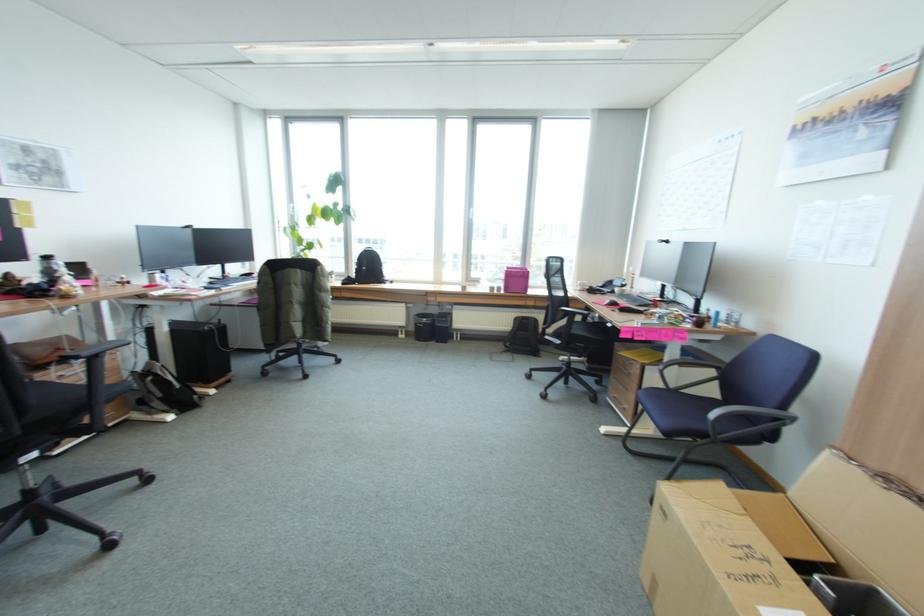
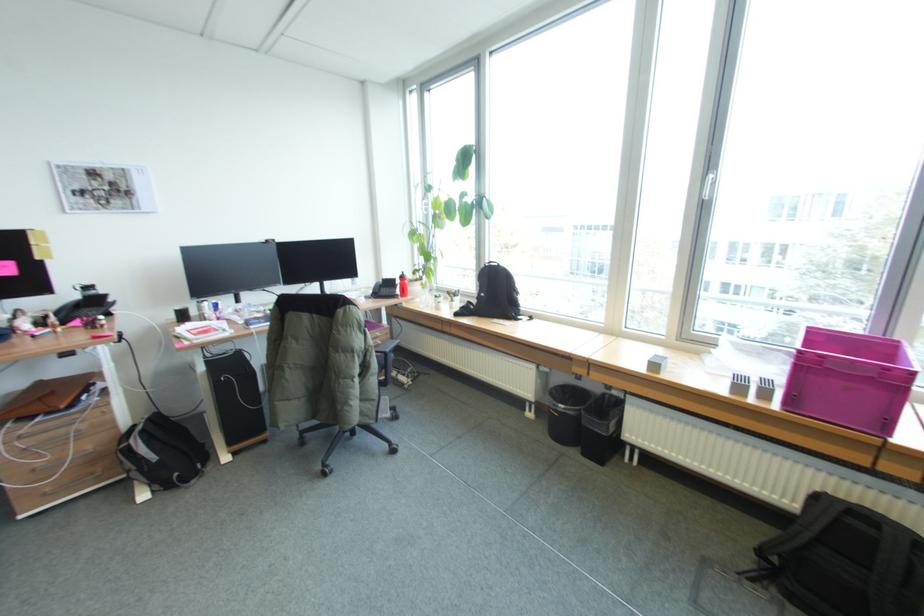
The point at (431, 320) is marked in the first image. Where is the corresponding point in the second image?

(568, 408)